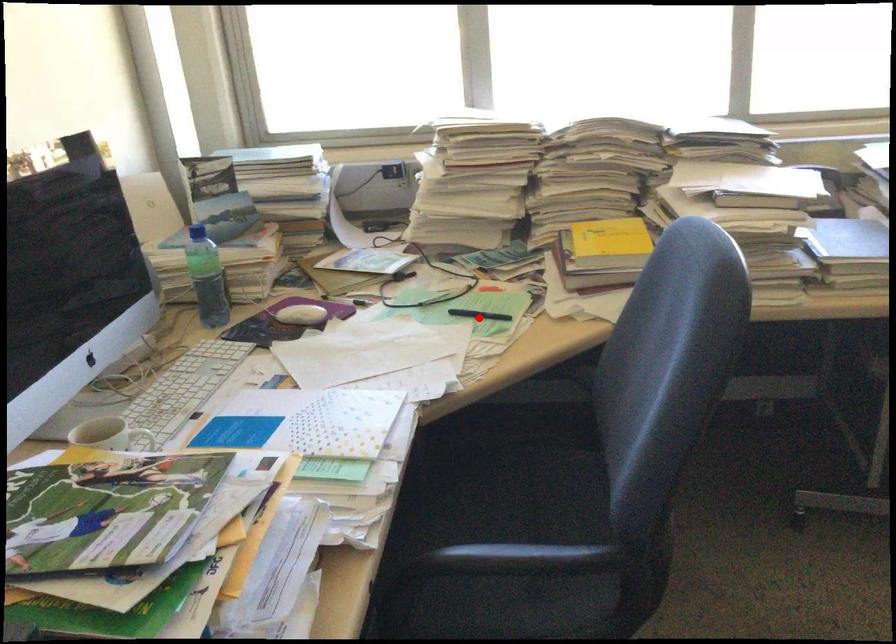
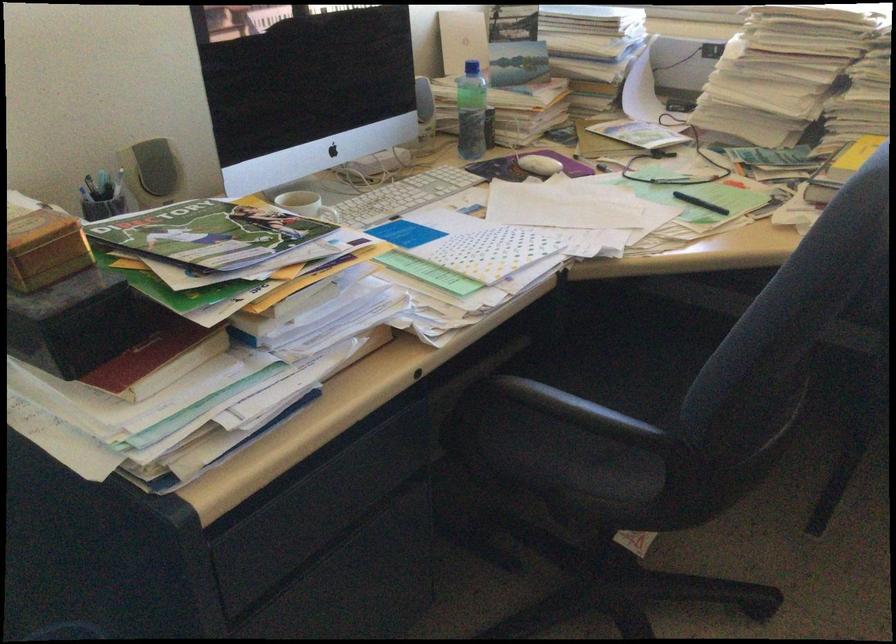
Where in the second image is the point corresponding to the highlighted location from the first image?

(700, 203)